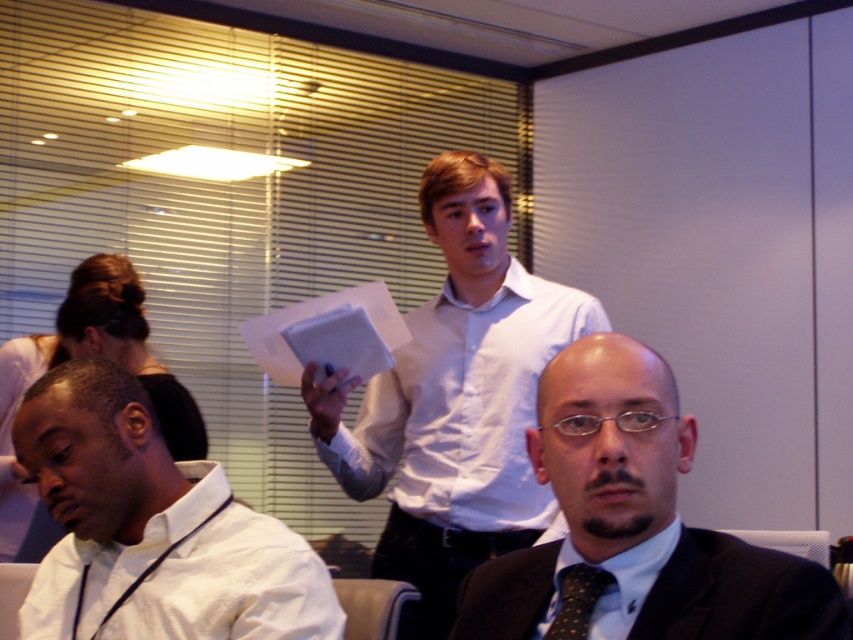
You are organizing a presentation and need to place a name tag on the table. The name tag must be placed to the left of the white paper at center. Can you place it there without overlapping the white textured shirt at center?

The white textured shirt at center is positioned on the right side of the white paper at center. Therefore, placing the name tag to the left of the white paper at center would not overlap the white textured shirt at center since it is to the right of the paper.

You are standing in the professional setting described. There is a point at coordinate (151, 529). What object is located at this coordinate?

The point at coordinate (151, 529) indicates the white shirt at lower left.

In the professional setting described, there is a point marked at coordinates (x=637, y=522). What object is located at this point?

The point at coordinates (x=637, y=522) indicates the location of the dark suit at center.